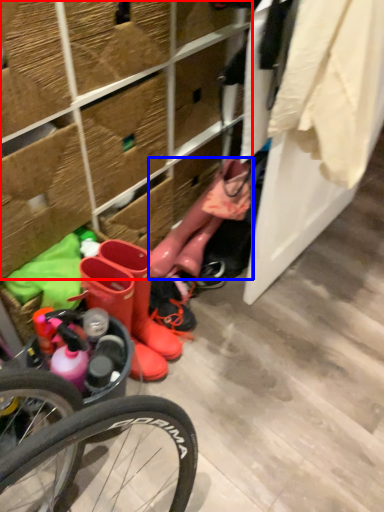
Question: Which point is closer to the camera, shelf (highlighted by a red box) or boot (highlighted by a blue box)?

Choices:
 (A) shelf
 (B) boot

Answer: (A)